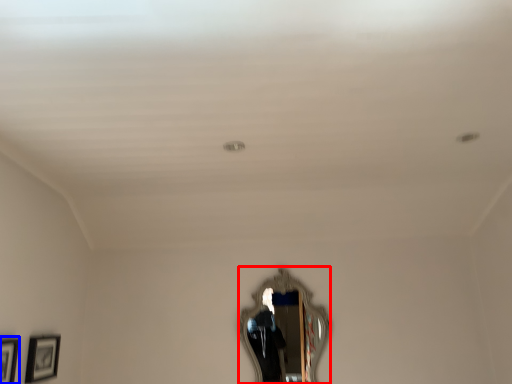
Question: Which point is closer to the camera, mirror (highlighted by a red box) or picture frame (highlighted by a blue box)?

Choices:
 (A) mirror
 (B) picture frame

Answer: (B)